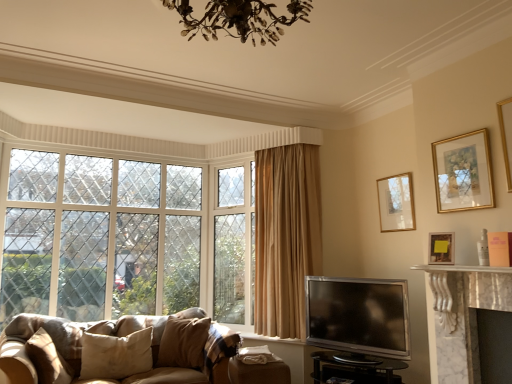
Locate an element on the screen. Image resolution: width=512 pixels, height=384 pixels. silver metallic tv at lower right is located at coordinates (358, 315).

How much space does gold-framed picture at upper right, marked as the third picture frame in a back-to-front arrangement, occupy vertically?

20.11 inches.

Describe the element at coordinates (125, 238) in the screenshot. Image resolution: width=512 pixels, height=384 pixels. I see `clear glass window at left` at that location.

Image resolution: width=512 pixels, height=384 pixels. In order to click on matte gold picture frame at upper right, placed as the second picture frame when sorted from front to back in this screenshot , I will do `click(441, 248)`.

What do you see at coordinates (123, 336) in the screenshot?
I see `suede-like beige couch at lower left` at bounding box center [123, 336].

Image resolution: width=512 pixels, height=384 pixels. Describe the element at coordinates (355, 368) in the screenshot. I see `black glass tv stand at lower center` at that location.

The width and height of the screenshot is (512, 384). Find the location of `beige cotton pillow at lower left, arranged as the second pillow when viewed from the right`. beige cotton pillow at lower left, arranged as the second pillow when viewed from the right is located at coordinates (116, 355).

Locate an element on the screen. silver metallic tv at lower right is located at coordinates (358, 315).

The width and height of the screenshot is (512, 384). I want to click on the 3rd picture frame counting from the right of the suede-like beige couch at lower left, so click(463, 172).

In terms of size, does gold-framed picture at upper right, marked as the third picture frame in a back-to-front arrangement, appear bigger or smaller than suede-like beige couch at lower left?

gold-framed picture at upper right, marked as the third picture frame in a back-to-front arrangement, is smaller than suede-like beige couch at lower left.

Is the position of gold-framed picture at upper right, the 1th picture frame in the front-to-back sequence, more distant than that of suede-like beige couch at lower left?

No, it is not.

From a real-world perspective, is gold-framed picture at upper right, the 1th picture frame in the front-to-back sequence, on top of suede-like beige couch at lower left?

Yes, from a real-world perspective, gold-framed picture at upper right, the 1th picture frame in the front-to-back sequence, is over suede-like beige couch at lower left

Which is less distant, (390, 205) or (113, 166)?

Point (390, 205) is closer to the camera than point (113, 166).

Considering the sizes of wooden picture frame at upper right, which is the 3th picture frame from front to back, and clear glass window at left in the image, is wooden picture frame at upper right, which is the 3th picture frame from front to back, bigger or smaller than clear glass window at left?

wooden picture frame at upper right, which is the 3th picture frame from front to back, is smaller than clear glass window at left.

Is wooden picture frame at upper right, which is the 3th picture frame from front to back, to the left or to the right of clear glass window at left in the image?

Clearly, wooden picture frame at upper right, which is the 3th picture frame from front to back, is on the right of clear glass window at left in the image.

Considering the relative sizes of matte gold picture frame at upper right, which is the 2th picture frame in back-to-front order, and beige cotton pillow at lower left, arranged as the second pillow when viewed from the right, in the image provided, is matte gold picture frame at upper right, which is the 2th picture frame in back-to-front order, wider than beige cotton pillow at lower left, arranged as the second pillow when viewed from the right,?

Incorrect, the width of matte gold picture frame at upper right, which is the 2th picture frame in back-to-front order, does not surpass that of beige cotton pillow at lower left, arranged as the second pillow when viewed from the right.

In the image, is matte gold picture frame at upper right, which is the 2th picture frame in back-to-front order, on the left side or the right side of beige cotton pillow at lower left, arranged as the second pillow when viewed from the right?

In the image, matte gold picture frame at upper right, which is the 2th picture frame in back-to-front order, appears on the right side of beige cotton pillow at lower left, arranged as the second pillow when viewed from the right.

Is matte gold picture frame at upper right, placed as the second picture frame when sorted from front to back, turned away from beige cotton pillow at lower left, which ranks as the 2th pillow in left-to-right order?

No, matte gold picture frame at upper right, placed as the second picture frame when sorted from front to back, is not facing away from beige cotton pillow at lower left, which ranks as the 2th pillow in left-to-right order.

Is beige cotton pillow at lower left, arranged as the second pillow when viewed from the right, surrounded by matte gold picture frame at upper right, placed as the second picture frame when sorted from front to back?

No, beige cotton pillow at lower left, arranged as the second pillow when viewed from the right, is not a part of matte gold picture frame at upper right, placed as the second picture frame when sorted from front to back.

Is black glass tv stand at lower center to the left or to the right of suede-like beige couch at lower left in the image?

Clearly, black glass tv stand at lower center is on the right of suede-like beige couch at lower left in the image.

Considering the sizes of black glass tv stand at lower center and suede-like beige couch at lower left in the image, is black glass tv stand at lower center wider or thinner than suede-like beige couch at lower left?

Considering their sizes, black glass tv stand at lower center looks slimmer than suede-like beige couch at lower left.

Is black glass tv stand at lower center inside the boundaries of suede-like beige couch at lower left, or outside?

black glass tv stand at lower center lies outside suede-like beige couch at lower left.

From a real-world perspective, does black glass tv stand at lower center sit lower than suede-like beige couch at lower left?

Correct, in the physical world, black glass tv stand at lower center is lower than suede-like beige couch at lower left.

From a real-world perspective, is beige fabric pillow at lower left, the 3th pillow when ordered from right to left, physically above wooden picture frame at upper right, which is the 3th picture frame from front to back?

No, from a real-world perspective, beige fabric pillow at lower left, the 3th pillow when ordered from right to left, is not over wooden picture frame at upper right, which is the 3th picture frame from front to back

Between beige fabric pillow at lower left, the 3th pillow when ordered from right to left, and wooden picture frame at upper right, the first picture frame when ordered from back to front, which one is positioned behind?

wooden picture frame at upper right, the first picture frame when ordered from back to front, is more distant.

Could you tell me if beige fabric pillow at lower left, acting as the 1th pillow starting from the left, is turned towards wooden picture frame at upper right, the first picture frame when ordered from back to front?

Yes, beige fabric pillow at lower left, acting as the 1th pillow starting from the left, is turned towards wooden picture frame at upper right, the first picture frame when ordered from back to front.

Which is correct: beige fabric pillow at lower left, acting as the 1th pillow starting from the left, is inside wooden picture frame at upper right, the first picture frame when ordered from back to front, or outside of it?

beige fabric pillow at lower left, acting as the 1th pillow starting from the left, is not enclosed by wooden picture frame at upper right, the first picture frame when ordered from back to front.

From a real-world perspective, who is located higher, suede-like beige couch at lower left or matte gold picture frame at upper right, placed as the second picture frame when sorted from front to back?

From a 3D spatial view, matte gold picture frame at upper right, placed as the second picture frame when sorted from front to back, is above.

Does suede-like beige couch at lower left have a lesser width compared to matte gold picture frame at upper right, which is the 2th picture frame in back-to-front order?

No.

Is suede-like beige couch at lower left smaller than matte gold picture frame at upper right, which is the 2th picture frame in back-to-front order?

Actually, suede-like beige couch at lower left might be larger than matte gold picture frame at upper right, which is the 2th picture frame in back-to-front order.

Is silver metallic tv at lower right facing towards matte gold picture frame at upper right, placed as the second picture frame when sorted from front to back?

No, silver metallic tv at lower right is not oriented towards matte gold picture frame at upper right, placed as the second picture frame when sorted from front to back.

What's the angular difference between silver metallic tv at lower right and matte gold picture frame at upper right, which is the 2th picture frame in back-to-front order,'s facing directions?

They differ by 1.5 degrees in their facing directions.

Find the location of a particular element. television located behind the matte gold picture frame at upper right, placed as the second picture frame when sorted from front to back is located at coordinates [358, 315].

Are silver metallic tv at lower right and matte gold picture frame at upper right, placed as the second picture frame when sorted from front to back, located far from each other?

No.

Locate an element on the screen. the 3rd picture frame above the suede-like beige couch at lower left (from a real-world perspective) is located at coordinates (463, 172).

I want to click on the 2nd picture frame to the right of the clear glass window at left, starting your count from the anchor, so click(396, 203).

From the image, which object appears to be nearer to matte gold picture frame at upper right, which is the 2th picture frame in back-to-front order, gold-framed picture at upper right, the 1th picture frame in the front-to-back sequence, or wooden picture frame at upper right, which is the 3th picture frame from front to back?

gold-framed picture at upper right, the 1th picture frame in the front-to-back sequence, lies closer to matte gold picture frame at upper right, which is the 2th picture frame in back-to-front order, than the other object.

Looking at the image, which one is located further to silver metallic tv at lower right, wooden picture frame at upper right, the first picture frame when ordered from back to front, or beige fabric pillow at lower left, the 3th pillow when ordered from right to left?

beige fabric pillow at lower left, the 3th pillow when ordered from right to left.

Considering their positions, is silver metallic tv at lower right positioned further to black glass tv stand at lower center than beige fabric pillow at lower left, the 3th pillow when ordered from right to left?

beige fabric pillow at lower left, the 3th pillow when ordered from right to left, is positioned further to the anchor black glass tv stand at lower center.

Considering their positions, is gold-framed picture at upper right, marked as the third picture frame in a back-to-front arrangement, positioned further to beige fabric pillow at lower left, the 3th pillow when ordered from right to left, than velvet beige pillow at lower center, arranged as the 3th pillow when viewed from the left?

gold-framed picture at upper right, marked as the third picture frame in a back-to-front arrangement, is positioned further to the anchor beige fabric pillow at lower left, the 3th pillow when ordered from right to left.

Estimate the real-world distances between objects in this image. Which object is further from gold-framed picture at upper right, the 1th picture frame in the front-to-back sequence, wooden picture frame at upper right, which is the 3th picture frame from front to back, or beige fabric pillow at lower left, acting as the 1th pillow starting from the left?

beige fabric pillow at lower left, acting as the 1th pillow starting from the left, is further to gold-framed picture at upper right, the 1th picture frame in the front-to-back sequence.

Looking at this image, looking at the image, which one is located closer to silver metallic tv at lower right, gold-framed picture at upper right, marked as the third picture frame in a back-to-front arrangement, or velvet beige pillow at lower center, arranged as the 3th pillow when viewed from the left?

gold-framed picture at upper right, marked as the third picture frame in a back-to-front arrangement, is positioned closer to the anchor silver metallic tv at lower right.

Looking at the image, which one is located further to velvet beige pillow at lower center, which ranks as the first pillow in right-to-left order, wooden picture frame at upper right, which is the 3th picture frame from front to back, or clear glass window at left?

Among the two, wooden picture frame at upper right, which is the 3th picture frame from front to back, is located further to velvet beige pillow at lower center, which ranks as the first pillow in right-to-left order.

Based on their spatial positions, is velvet beige pillow at lower center, arranged as the 3th pillow when viewed from the left, or beige cotton pillow at lower left, arranged as the second pillow when viewed from the right, further from black glass tv stand at lower center?

Based on the image, beige cotton pillow at lower left, arranged as the second pillow when viewed from the right, appears to be further to black glass tv stand at lower center.

Image resolution: width=512 pixels, height=384 pixels. Identify the location of studio couch located between clear glass window at left and matte gold picture frame at upper right, which is the 2th picture frame in back-to-front order, in the left-right direction. (123, 336).

What are the coordinates of `television located between velvet beige pillow at lower center, which ranks as the first pillow in right-to-left order, and black glass tv stand at lower center in the left-right direction` in the screenshot? It's located at (358, 315).

In order to click on television between velvet beige pillow at lower center, which ranks as the first pillow in right-to-left order, and wooden picture frame at upper right, the first picture frame when ordered from back to front in this screenshot , I will do `click(358, 315)`.

Where is `studio couch between beige cotton pillow at lower left, arranged as the second pillow when viewed from the right, and matte gold picture frame at upper right, which is the 2th picture frame in back-to-front order, from left to right`? studio couch between beige cotton pillow at lower left, arranged as the second pillow when viewed from the right, and matte gold picture frame at upper right, which is the 2th picture frame in back-to-front order, from left to right is located at coordinates (123, 336).